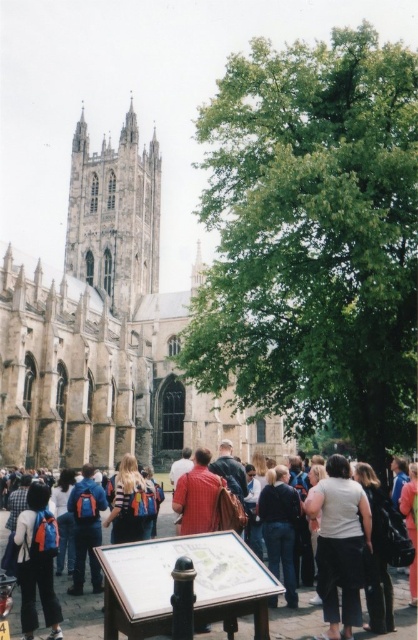
You are standing in front of the stone gothic cathedral at center and the striped shirt backpack at center. Which object is positioned higher in the image?

The stone gothic cathedral at center is located above the striped shirt backpack at center, so it is positioned higher in the image.

You are a photographer trying to capture a photo of the dark blue jeans at lower right and the dark blue leather jacket at center. Which object should you focus on first if you want to include both in your frame without moving the camera?

The dark blue jeans at lower right is smaller than the dark blue leather jacket at center, so you should focus on the dark blue leather jacket at center first to ensure it fits properly in the frame.

You are standing at the entrance of the stone gothic cathedral at center. A tour guide asks you to locate the central spire relative to the cathedral. Where is the central spire positioned?

The central spire of the stone gothic cathedral at center is positioned at the highest point, towering above the rest of the building, as described in the scene.